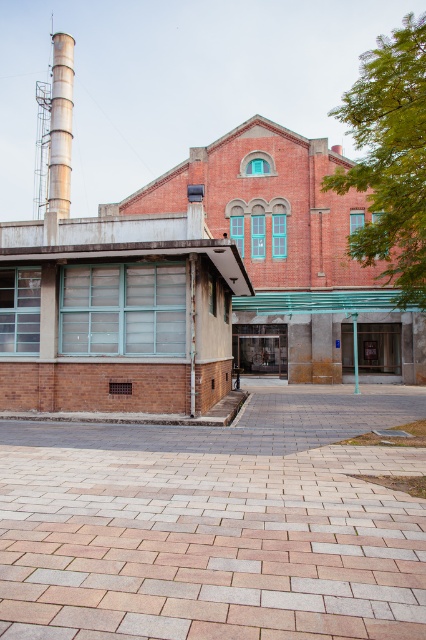
Which of these two, pebble stone pavement at center or brushed metal pipe at upper left, stands taller?

Standing taller between the two is brushed metal pipe at upper left.

Is pebble stone pavement at center bigger than brushed metal pipe at upper left?

No.

Does point (419, 516) come closer to viewer compared to point (60, 193)?

Yes, it is.

The width and height of the screenshot is (426, 640). Identify the location of pebble stone pavement at center. (215, 524).

Image resolution: width=426 pixels, height=640 pixels. Describe the element at coordinates (215, 524) in the screenshot. I see `pebble stone pavement at center` at that location.

Does point (147, 536) come farther from viewer compared to point (353, 280)?

No, (147, 536) is closer to viewer.

Find the location of a particular element. The width and height of the screenshot is (426, 640). pebble stone pavement at center is located at coordinates (215, 524).

Measure the distance between point (227, 202) and camera.

28.71 meters

Which is behind, point (307, 141) or point (354, 368)?

The point (307, 141) is behind.

Between point (331, 225) and point (356, 355), which one is positioned behind?

The point (331, 225) is more distant.

Identify the location of red brick building at center. The image size is (426, 640). (291, 257).